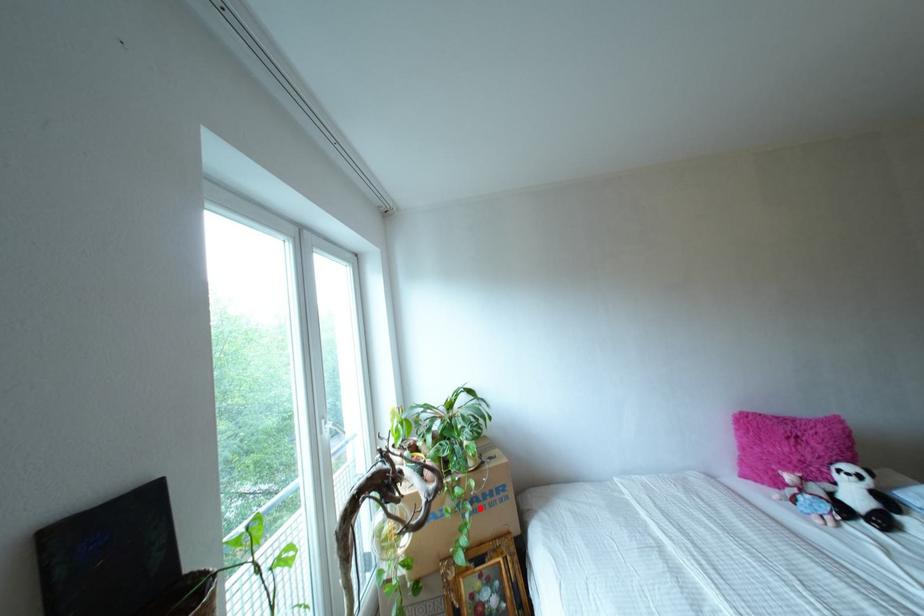
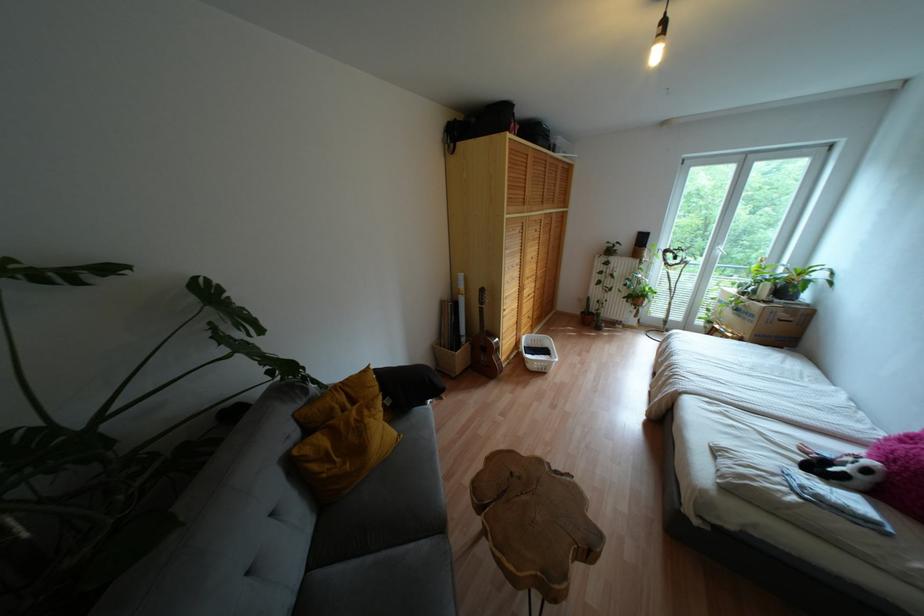
Question: I am providing you with two images of the same scene from different viewpoints. A red point is shown in image1. For the corresponding object point in image2, is it positioned nearer or farther from the camera?

Choices:
 (A) Nearer
 (B) Farther

Answer: (A)